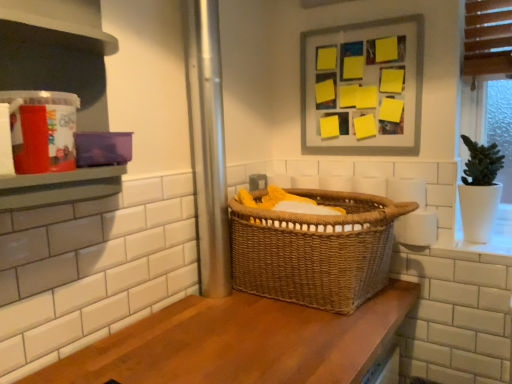
Identify the location of vacant region below matte plastic container at left (from a real-world perspective). The image size is (512, 384). (95, 356).